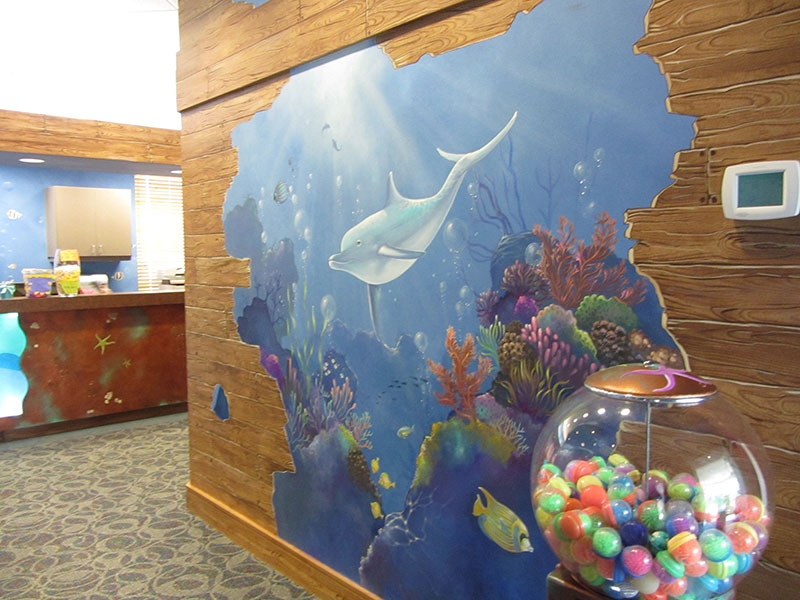
Locate an element on the screen. wooden border on wall is located at coordinates (58, 142), (258, 42).